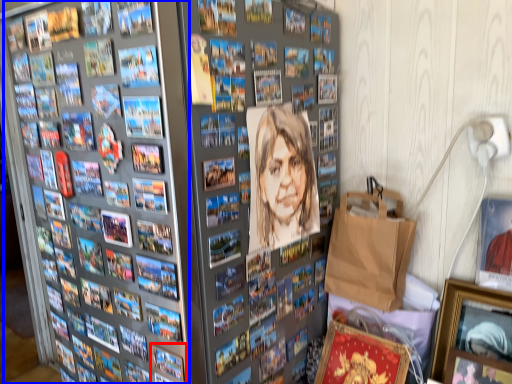
Question: Which of the following is the farthest to the observer, picture frame (highlighted by a red box) or comic book (highlighted by a blue box)?

Choices:
 (A) picture frame
 (B) comic book

Answer: (A)